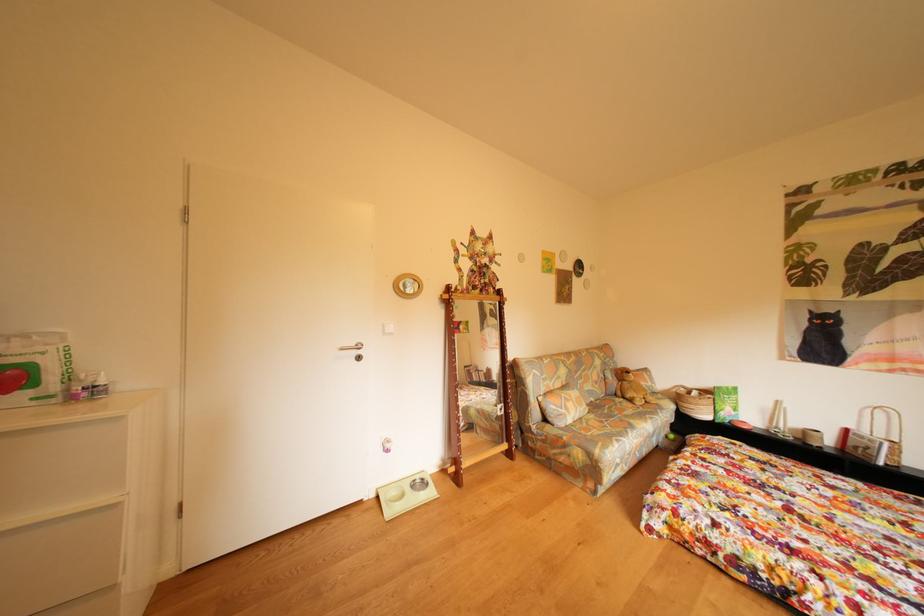
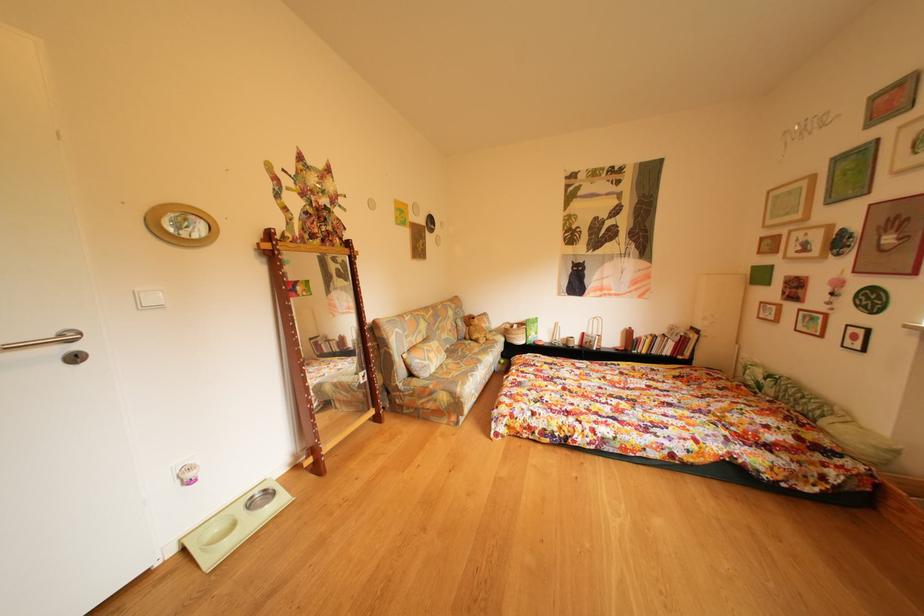
Question: The images are taken continuously from a first-person perspective. In which direction is your viewpoint rotating?

Choices:
 (A) Left
 (B) Right
 (C) Up
 (D) Down

Answer: (B)